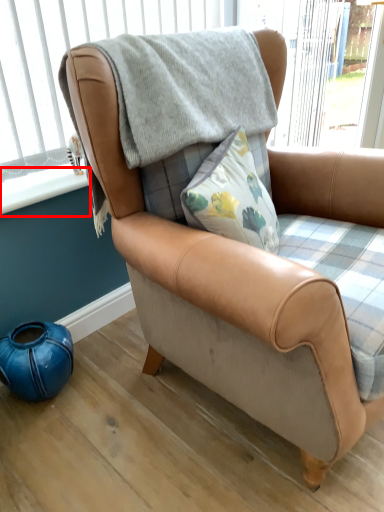
Question: From the image's perspective, what is the correct spatial positioning of window sill (annotated by the red box) in reference to window frame?

Choices:
 (A) below
 (B) above

Answer: (A)